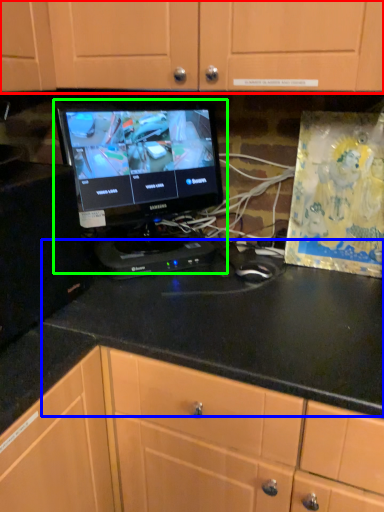
Question: Considering the real-world distances, which object is farthest from cabinetry (highlighted by a red box)? counter top (highlighted by a blue box) or computer monitor (highlighted by a green box)?

Choices:
 (A) counter top
 (B) computer monitor

Answer: (A)